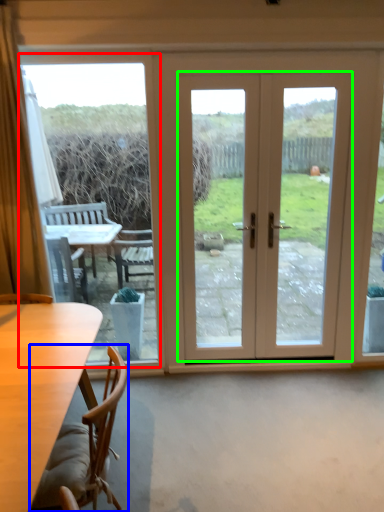
Question: Considering the real-world distances, which object is closest to window screen (highlighted by a red box)? chair (highlighted by a blue box) or door (highlighted by a green box).

Choices:
 (A) chair
 (B) door

Answer: (A)